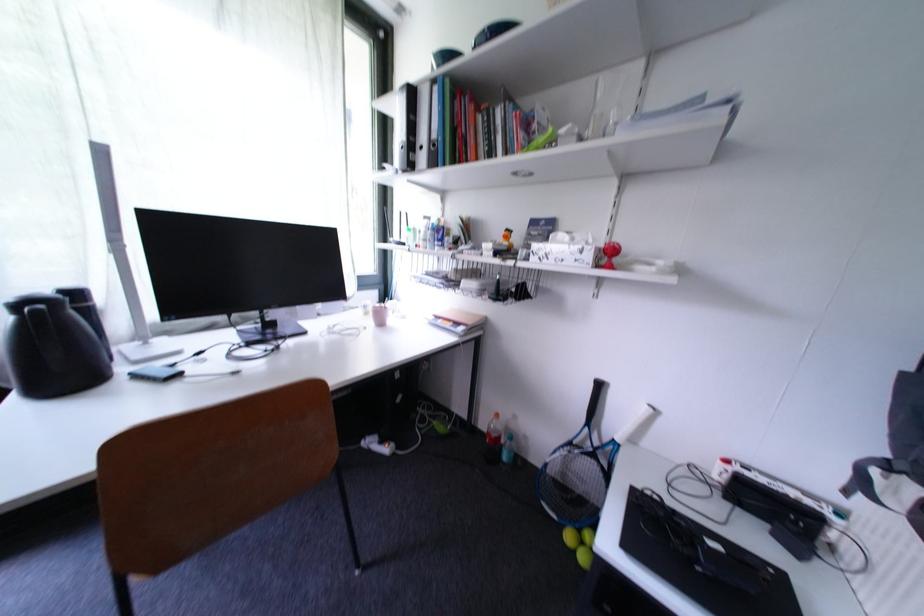
You are a GUI agent. You are given a task and a screenshot of the screen. Output one action in this format:
    pyautogui.click(x=<x>, y=<y>)
    Task: Click on the blue tennis racket handle
    Image resolution: width=924 pixels, height=616 pixels.
    Given the screenshot: What is the action you would take?
    pyautogui.click(x=593, y=400)